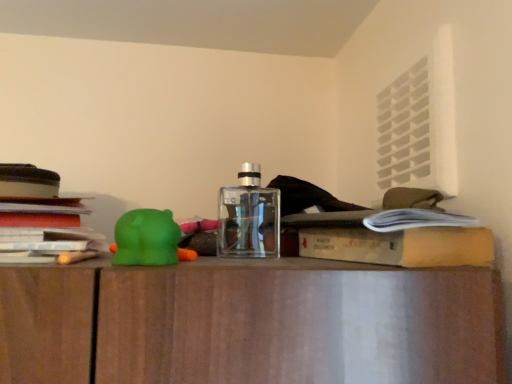
Question: From the image's perspective, is transparent glass bottle at center located beneath stacked paper at left?

Choices:
 (A) no
 (B) yes

Answer: (A)

Question: Is the depth of transparent glass bottle at center greater than that of stacked paper at left?

Choices:
 (A) yes
 (B) no

Answer: (A)

Question: Is transparent glass bottle at center located outside stacked paper at left?

Choices:
 (A) yes
 (B) no

Answer: (A)

Question: Considering the relative sizes of transparent glass bottle at center and stacked paper at left in the image provided, is transparent glass bottle at center bigger than stacked paper at left?

Choices:
 (A) no
 (B) yes

Answer: (A)

Question: Is transparent glass bottle at center oriented towards stacked paper at left?

Choices:
 (A) yes
 (B) no

Answer: (B)

Question: Considering the positions of transparent glass bottle at center and hardcover book at center in the image, is transparent glass bottle at center taller or shorter than hardcover book at center?

Choices:
 (A) short
 (B) tall

Answer: (B)

Question: Is point [248, 175] closer or farther from the camera than point [303, 251]?

Choices:
 (A) farther
 (B) closer

Answer: (A)

Question: Is transparent glass bottle at center bigger or smaller than hardcover book at center?

Choices:
 (A) small
 (B) big

Answer: (A)

Question: From the image's perspective, is transparent glass bottle at center above or below hardcover book at center?

Choices:
 (A) above
 (B) below

Answer: (A)

Question: Considering the positions of hardcover book at center and stacked paper at left in the image, is hardcover book at center taller or shorter than stacked paper at left?

Choices:
 (A) tall
 (B) short

Answer: (B)

Question: Does point coord(391,251) appear closer or farther from the camera than point coord(31,210)?

Choices:
 (A) farther
 (B) closer

Answer: (B)

Question: Considering their positions, is hardcover book at center located in front of or behind stacked paper at left?

Choices:
 (A) behind
 (B) front

Answer: (A)

Question: Looking at the image, does hardcover book at center seem bigger or smaller compared to stacked paper at left?

Choices:
 (A) small
 (B) big

Answer: (A)

Question: From a real-world perspective, is green rubber bear at left above or below hardcover book at center?

Choices:
 (A) below
 (B) above

Answer: (B)

Question: Is point (159, 264) closer or farther from the camera than point (374, 243)?

Choices:
 (A) farther
 (B) closer

Answer: (B)